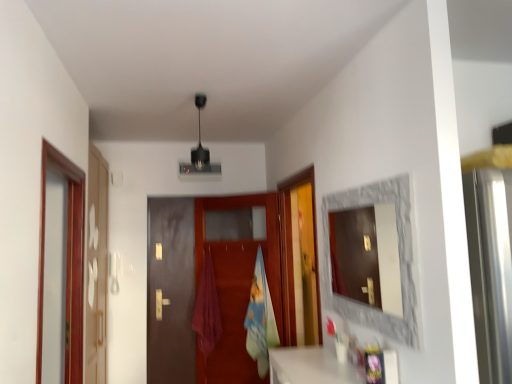
Question: Is brown matte door at center smaller than brown wooden screen door at left, which is the first screen door in front-to-back order?

Choices:
 (A) yes
 (B) no

Answer: (A)

Question: Is brown matte door at center positioned in front of brown wooden screen door at left, which is the first screen door in front-to-back order?

Choices:
 (A) yes
 (B) no

Answer: (B)

Question: Is brown matte door at center facing away from brown wooden screen door at left, which is the first screen door in front-to-back order?

Choices:
 (A) no
 (B) yes

Answer: (A)

Question: Does brown matte door at center touch brown wooden screen door at left, which is the first screen door in front-to-back order?

Choices:
 (A) no
 (B) yes

Answer: (A)

Question: Could you tell me if brown matte door at center is turned towards brown wooden screen door at left, which is the first screen door in front-to-back order?

Choices:
 (A) no
 (B) yes

Answer: (B)

Question: From a real-world perspective, is brown matte door at center positioned under brown wooden screen door at left, the 2th screen door in the back-to-front sequence, based on gravity?

Choices:
 (A) yes
 (B) no

Answer: (A)

Question: Is blue cotton beach towel at center at the left side of brown wooden screen door at left, the 2th screen door in the back-to-front sequence?

Choices:
 (A) yes
 (B) no

Answer: (B)

Question: Can you confirm if blue cotton beach towel at center is positioned to the right of brown wooden screen door at left, the 2th screen door in the back-to-front sequence?

Choices:
 (A) no
 (B) yes

Answer: (B)

Question: Can you confirm if blue cotton beach towel at center is thinner than brown wooden screen door at left, which is the first screen door in front-to-back order?

Choices:
 (A) no
 (B) yes

Answer: (A)

Question: From the image's perspective, is blue cotton beach towel at center under brown wooden screen door at left, the 2th screen door in the back-to-front sequence?

Choices:
 (A) no
 (B) yes

Answer: (B)

Question: Is blue cotton beach towel at center completely or partially outside of brown wooden screen door at left, which is the first screen door in front-to-back order?

Choices:
 (A) yes
 (B) no

Answer: (A)

Question: From the image's perspective, is blue cotton beach towel at center located above brown wooden screen door at left, which is the first screen door in front-to-back order?

Choices:
 (A) yes
 (B) no

Answer: (B)

Question: Is the depth of stone textured mirror at right less than that of blue cotton beach towel at center?

Choices:
 (A) yes
 (B) no

Answer: (A)